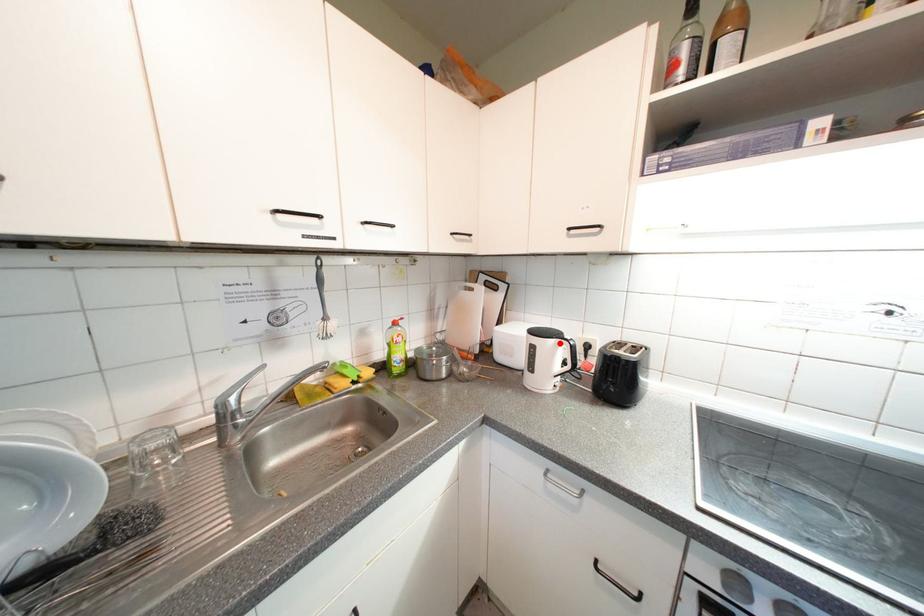
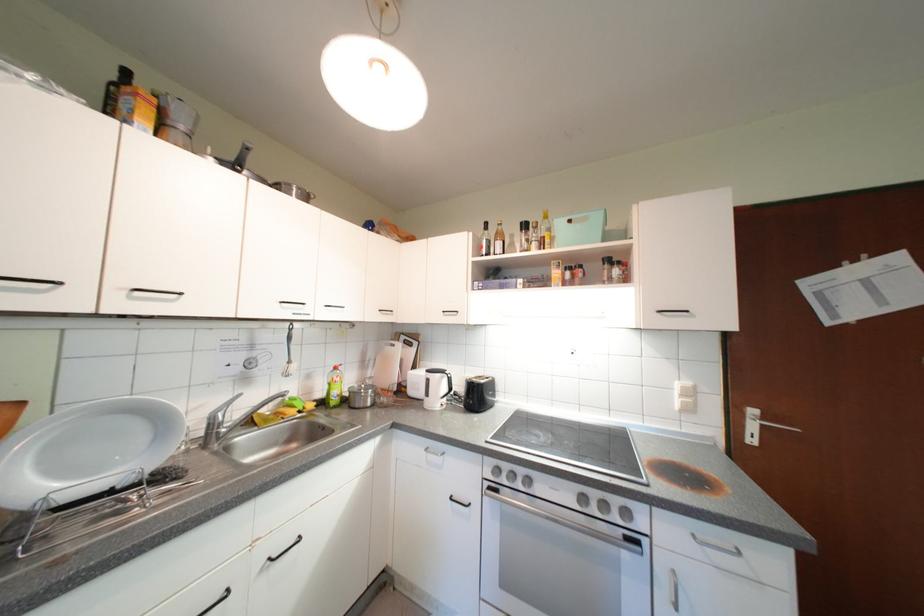
Where in the second image is the point corresponding to the highlighted location from the first image?

(446, 378)